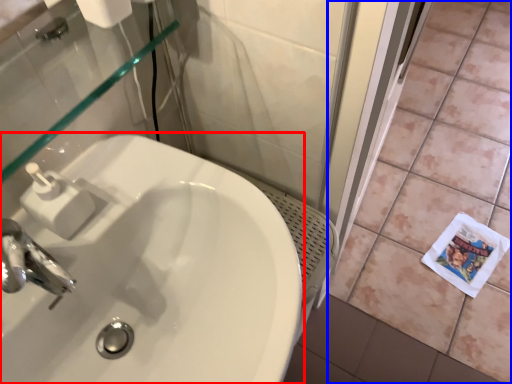
Question: Which object appears closest to the camera in this image, sink (highlighted by a red box) or ceramic tile (highlighted by a blue box)?

Choices:
 (A) sink
 (B) ceramic tile

Answer: (A)